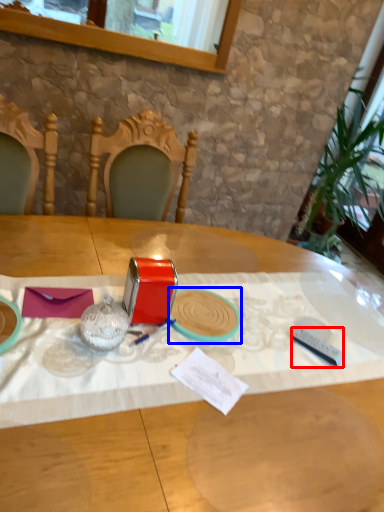
Question: Which object appears farthest to the camera in this image, tableware (highlighted by a red box) or tableware (highlighted by a blue box)?

Choices:
 (A) tableware
 (B) tableware

Answer: (A)